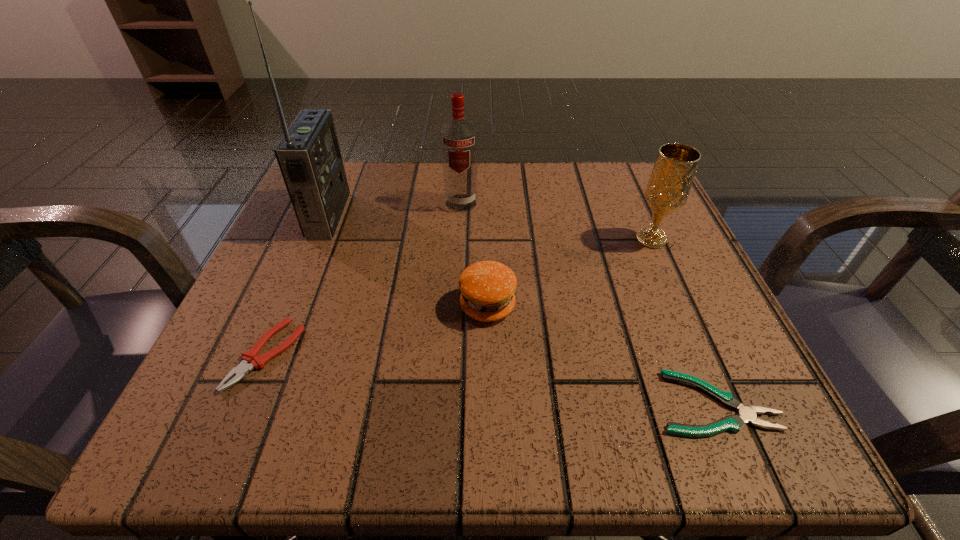
The image size is (960, 540). What are the coordinates of `radio receiver` in the screenshot? It's located at (308, 155).

Locate an element on the screen. This screenshot has height=540, width=960. vodka is located at coordinates (459, 138).

This screenshot has width=960, height=540. I want to click on the fourth shortest object, so click(x=673, y=173).

Identify the location of the third shortest object. (487, 288).

This screenshot has width=960, height=540. Find the location of `the taller pliers`. the taller pliers is located at coordinates (250, 359).

Where is `the second shortest object`? the second shortest object is located at coordinates (250, 359).

At what (x,y) coordinates should I click in order to perform the action: click on the shortest object. Please return your answer as a coordinate pair (x, y). The image size is (960, 540). Looking at the image, I should click on (747, 414).

Identify the location of the right pliers. The width and height of the screenshot is (960, 540). (747, 414).

Identify the location of free space located on the display of the radio receiver. This screenshot has width=960, height=540. (370, 215).

The image size is (960, 540). I want to click on free space located 0.320m on the front label of the second tallest object, so click(x=454, y=342).